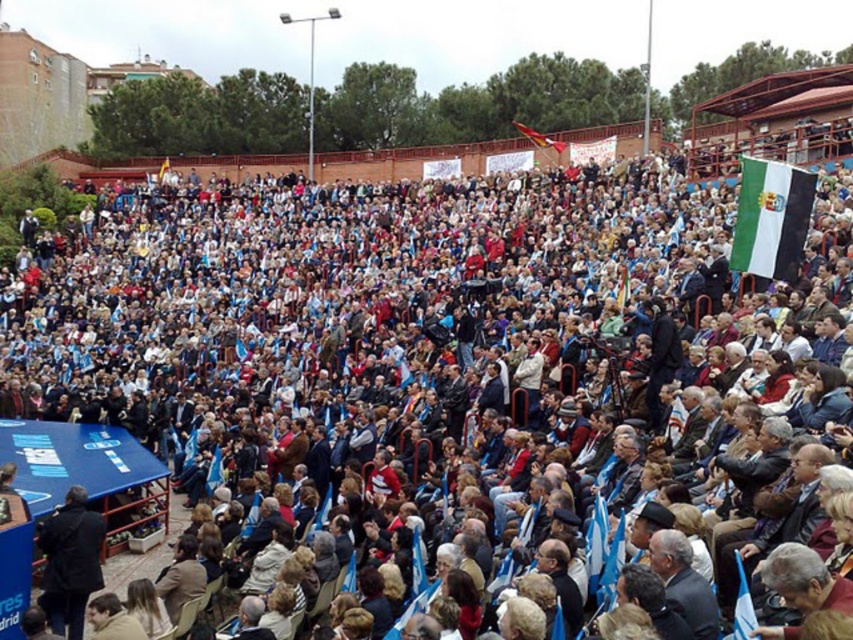
The image size is (853, 640). Find the location of `white and black fabric flag at upper right`. white and black fabric flag at upper right is located at coordinates (770, 218).

Between white and black fabric flag at upper right and white fabric flag at center, which one is positioned lower?

white and black fabric flag at upper right

Is point (759, 241) positioned before point (554, 145)?

Yes, it is in front of point (554, 145).

Locate an element on the screen. This screenshot has height=640, width=853. white and black fabric flag at upper right is located at coordinates (770, 218).